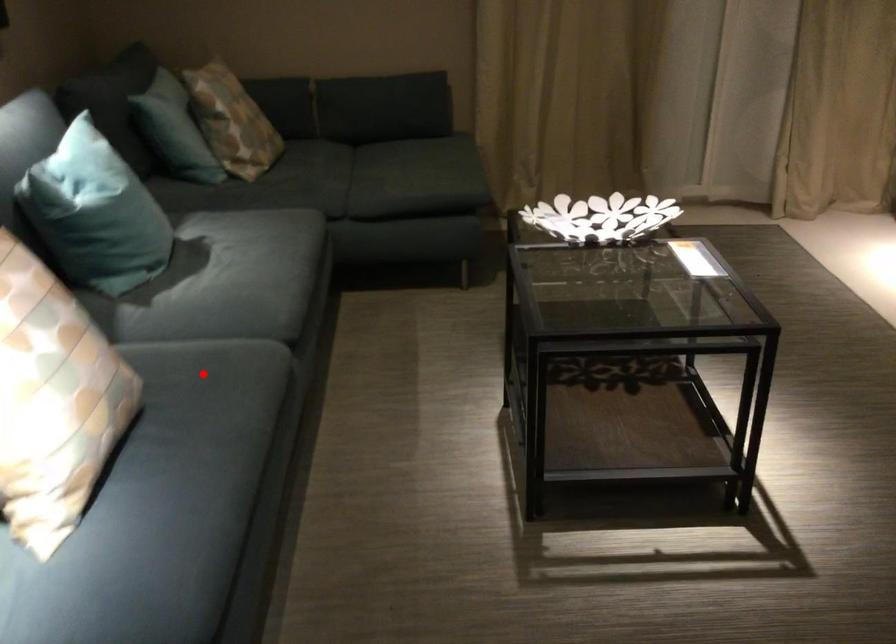
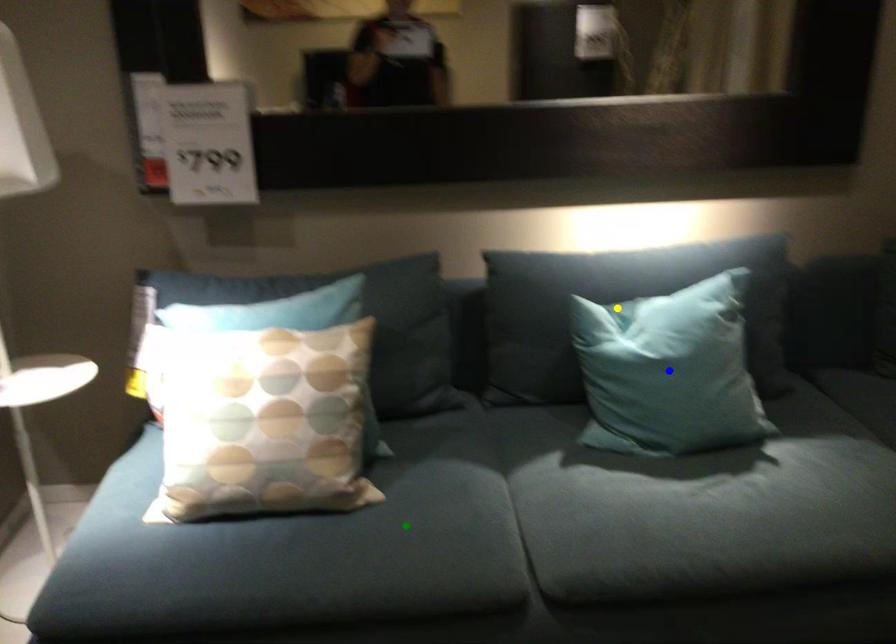
Question: I am providing you with two images of the same scene from different viewpoints. A red point is marked on the first image. You are given multiple points on the second image. Which point in image 2 is actually the same real-world point as the red point in image 1?

Choices:
 (A) yellow point
 (B) blue point
 (C) green point

Answer: (C)